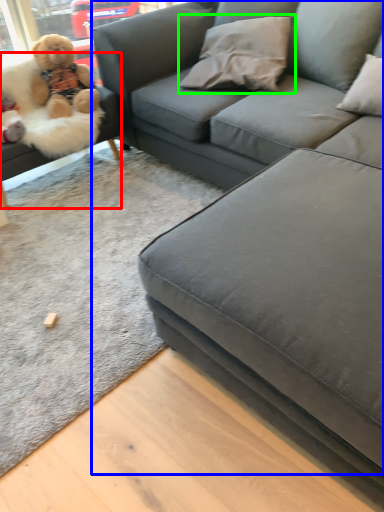
Question: Which object is the closest to the studio couch (highlighted by a red box)? Choose among these: studio couch (highlighted by a blue box) or pillow (highlighted by a green box).

Choices:
 (A) studio couch
 (B) pillow

Answer: (B)